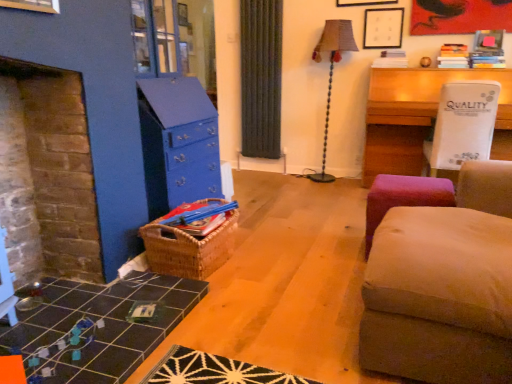
The image size is (512, 384). Identify the location of textured beige lampshade at center-right. (332, 73).

Describe the element at coordinates (420, 116) in the screenshot. I see `white plastic table at upper right, acting as the first table starting from the right` at that location.

This screenshot has height=384, width=512. Find the location of `pink fabric stool at lower right`. pink fabric stool at lower right is located at coordinates (403, 198).

Could you tell me if velvet beige ottoman at right is facing textured beige lampshade at center-right?

No, velvet beige ottoman at right is not turned towards textured beige lampshade at center-right.

Is textured beige lampshade at center-right completely or partially inside velvet beige ottoman at right?

No, velvet beige ottoman at right does not contain textured beige lampshade at center-right.

Between point (443, 214) and point (354, 51), which one is positioned in front?

The point (443, 214) is in front.

Is the position of textured beige lampshade at center-right more distant than that of pink fabric stool at lower right?

Yes, it is behind pink fabric stool at lower right.

Is textured beige lampshade at center-right facing towards pink fabric stool at lower right?

No, textured beige lampshade at center-right is not aimed at pink fabric stool at lower right.

Considering the relative sizes of textured beige lampshade at center-right and pink fabric stool at lower right in the image provided, is textured beige lampshade at center-right shorter than pink fabric stool at lower right?

No, textured beige lampshade at center-right is not shorter than pink fabric stool at lower right.

How different are the orientations of textured beige lampshade at center-right and pink fabric stool at lower right in degrees?

They differ by 5.51 degrees in their facing directions.

Is point (102, 320) behind point (323, 46)?

No.

From a real-world perspective, between black tile table at lower left, arranged as the second table when viewed from the top, and textured beige lampshade at center-right, who is vertically lower?

black tile table at lower left, arranged as the second table when viewed from the top, from a real-world perspective.

Can you tell me how much black tile table at lower left, which appears as the first table when viewed from the front, and textured beige lampshade at center-right differ in facing direction?

87.8 degrees.

You are a GUI agent. You are given a task and a screenshot of the screen. Output one action in this format:
    pyautogui.click(x=<x>, y=<y>)
    Task: Click on the 2nd table directly beneath the textured beige lampshade at center-right (from a real-world perspective)
    The height and width of the screenshot is (384, 512).
    Given the screenshot: What is the action you would take?
    pyautogui.click(x=97, y=328)

Is white plastic table at upper right, acting as the first table starting from the right, positioned behind woven brown basket at center?

Yes, it is.

Which point is more forward, (444,172) or (185,255)?

The point (185,255) is closer to the camera.

From a real-world perspective, is white plastic table at upper right, acting as the first table starting from the right, physically above woven brown basket at center?

Yes, from a real-world perspective, white plastic table at upper right, acting as the first table starting from the right, is above woven brown basket at center.

Can we say matte black picture frame at upper center lies outside velvet beige ottoman at right?

Yes, matte black picture frame at upper center is located beyond the bounds of velvet beige ottoman at right.

Is matte black picture frame at upper center oriented away from velvet beige ottoman at right?

No.

From the image's perspective, is matte black picture frame at upper center beneath velvet beige ottoman at right?

No, from the image's perspective, matte black picture frame at upper center is not below velvet beige ottoman at right.

From a real-world perspective, is velvet beige ottoman at right located higher than black tile table at lower left, the 1th table from the left?

Yes.

Is velvet beige ottoman at right completely or partially outside of black tile table at lower left, the 1th table from the left?

Yes.

What's the angular difference between velvet beige ottoman at right and black tile table at lower left, positioned as the 1th table in bottom-to-top order,'s facing directions?

The angle between the facing direction of velvet beige ottoman at right and the facing direction of black tile table at lower left, positioned as the 1th table in bottom-to-top order, is 179 degrees.

Is point (220, 251) closer or farther from the camera than point (382, 25)?

Point (220, 251) is positioned closer to the camera compared to point (382, 25).

Does woven brown basket at center lie behind matte black picture frame at upper center?

No, woven brown basket at center is in front of matte black picture frame at upper center.

Considering the positions of objects woven brown basket at center and matte black picture frame at upper center in the image provided, who is more to the right, woven brown basket at center or matte black picture frame at upper center?

From the viewer's perspective, matte black picture frame at upper center appears more on the right side.

What are the coordinates of `table lamp that appears above the velvet beige ottoman at right (from the image's perspective)` in the screenshot? It's located at (332, 73).

I want to click on stool that appears in front of the textured beige lampshade at center-right, so click(x=403, y=198).

Which object lies further to the anchor point white plastic table at upper right, acting as the first table starting from the right, pink fabric stool at lower right or black tile table at lower left, which appears as the first table when viewed from the front?

black tile table at lower left, which appears as the first table when viewed from the front.

Estimate the real-world distances between objects in this image. Which object is further from textured beige lampshade at center-right, matte black picture frame at upper center or white plastic table at upper right, which appears as the first table when viewed from the top?

white plastic table at upper right, which appears as the first table when viewed from the top, is further to textured beige lampshade at center-right.

Considering their positions, is textured beige lampshade at center-right positioned closer to black tile table at lower left, arranged as the second table when viewed from the top, than matte black picture frame at upper center?

textured beige lampshade at center-right.

From the image, which object appears to be farther from matte black picture frame at upper center, black tile table at lower left, the 1th table from the left, or textured beige lampshade at center-right?

black tile table at lower left, the 1th table from the left, lies further to matte black picture frame at upper center than the other object.

Based on their spatial positions, is black tile table at lower left, the 1th table from the left, or woven brown basket at center further from matte black picture frame at upper center?

The object further to matte black picture frame at upper center is black tile table at lower left, the 1th table from the left.

Looking at the image, which one is located further to velvet beige ottoman at right, matte black picture frame at upper center or pink fabric stool at lower right?

Among the two, matte black picture frame at upper center is located further to velvet beige ottoman at right.

Looking at the image, which one is located closer to white plastic table at upper right, the 1th table from the back, textured beige lampshade at center-right or velvet beige ottoman at right?

textured beige lampshade at center-right is positioned closer to the anchor white plastic table at upper right, the 1th table from the back.

When comparing their distances from velvet beige ottoman at right, does white plastic table at upper right, positioned as the second table in front-to-back order, or matte black picture frame at upper center seem closer?

white plastic table at upper right, positioned as the second table in front-to-back order, is closer to velvet beige ottoman at right.

Locate an element on the screen. picture frame between black tile table at lower left, arranged as the second table when viewed from the top, and white plastic table at upper right, the 1th table from the back is located at coordinates (383, 28).

You are a GUI agent. You are given a task and a screenshot of the screen. Output one action in this format:
    pyautogui.click(x=<x>, y=<y>)
    Task: Click on the studio couch situated between black tile table at lower left, arranged as the second table when viewed from the top, and pink fabric stool at lower right from left to right
    The height and width of the screenshot is (384, 512).
    Given the screenshot: What is the action you would take?
    pyautogui.click(x=444, y=286)

The width and height of the screenshot is (512, 384). I want to click on table lamp between matte black picture frame at upper center and white plastic table at upper right, marked as the second table in a bottom-to-top arrangement, vertically, so click(332, 73).

Find the location of a particular element. crate between black tile table at lower left, the 1th table from the left, and matte black picture frame at upper center in the front-back direction is located at coordinates (189, 248).